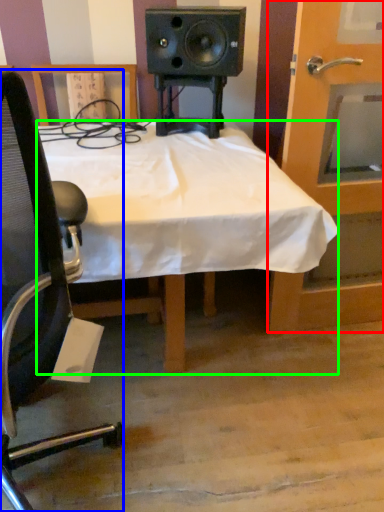
Question: Which is farther away from door (highlighted by a red box)? chair (highlighted by a blue box) or desk (highlighted by a green box)?

Choices:
 (A) chair
 (B) desk

Answer: (A)